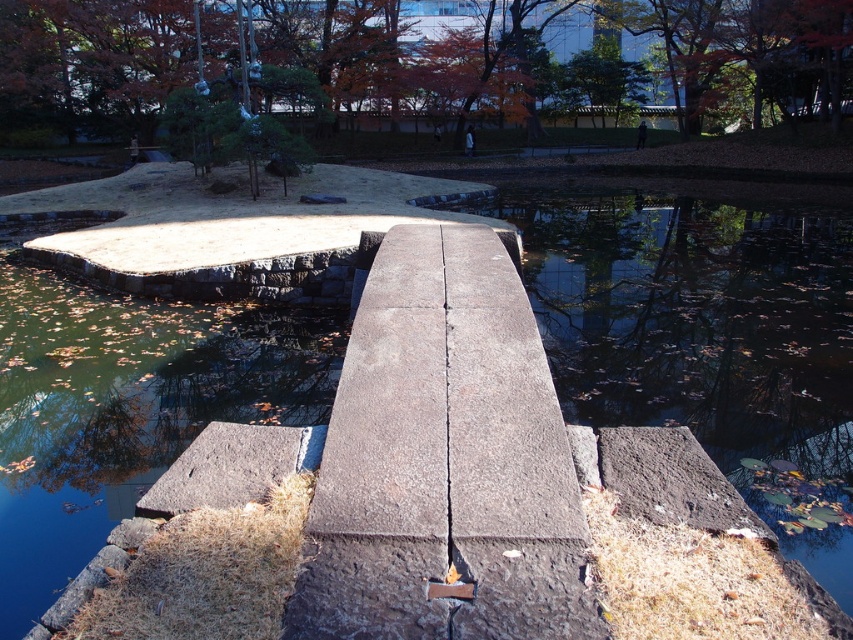
Does gray concrete bench at center appear over orange autumn leaves at upper center?

Actually, gray concrete bench at center is below orange autumn leaves at upper center.

In order to click on gray concrete bench at center in this screenshot , I will do `click(444, 460)`.

This screenshot has width=853, height=640. Identify the location of gray concrete bench at center. (444, 460).